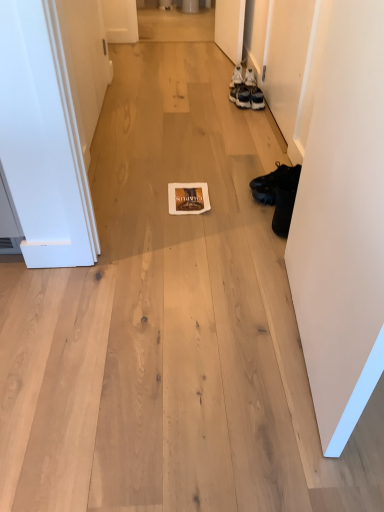
Measure the distance between point (259, 187) and camera.

The depth of point (259, 187) is 2.15 meters.

Describe the element at coordinates (240, 96) in the screenshot. This screenshot has width=384, height=512. I see `matte black sneakers at upper right, which is the third footwear from front to back` at that location.

Measure the distance between point (243,95) and camera.

A distance of 3.04 meters exists between point (243,95) and camera.

Locate an element on the screen. This screenshot has height=512, width=384. matte brown magazine at center is located at coordinates (188, 198).

Which of these two, matte black sneakers at upper right, which is the third footwear from front to back, or black leather boot at right, placed as the 2th footwear when sorted from bottom to top, is smaller?

Smaller between the two is matte black sneakers at upper right, which is the third footwear from front to back.

From the image's perspective, which one is positioned higher, matte black sneakers at upper right, which is the 3th footwear from bottom to top, or black leather boot at right, placed as the 2th footwear when sorted from bottom to top?

matte black sneakers at upper right, which is the 3th footwear from bottom to top, from the image's perspective.

Considering the relative positions of matte black sneakers at upper right, marked as the 2th footwear in a back-to-front arrangement, and black leather boot at right, which is the 2th footwear from front to back, in the image provided, is matte black sneakers at upper right, marked as the 2th footwear in a back-to-front arrangement, to the right of black leather boot at right, which is the 2th footwear from front to back, from the viewer's perspective?

Answer: In fact, matte black sneakers at upper right, marked as the 2th footwear in a back-to-front arrangement, is to the left of black leather boot at right, which is the 2th footwear from front to back.

Looking at this image, would you say white leather sneakers at upper right, the 4th footwear ordered from the bottom, is outside matte black sneakers at upper right, which is the 3th footwear from bottom to top?

Yes, white leather sneakers at upper right, the 4th footwear ordered from the bottom, is outside of matte black sneakers at upper right, which is the 3th footwear from bottom to top.

In the image, is white leather sneakers at upper right, the fourth footwear from the front, on the left side or the right side of matte black sneakers at upper right, marked as the 2th footwear in a back-to-front arrangement?

Clearly, white leather sneakers at upper right, the fourth footwear from the front, is on the right of matte black sneakers at upper right, marked as the 2th footwear in a back-to-front arrangement, in the image.

Which object is thinner, white leather sneakers at upper right, which ranks as the 1th footwear in back-to-front order, or matte black sneakers at upper right, which is the third footwear from front to back?

white leather sneakers at upper right, which ranks as the 1th footwear in back-to-front order, is thinner.

Does white leather sneakers at upper right, acting as the 1th footwear starting from the top, have a larger size compared to matte black sneakers at upper right, which is the 3th footwear from bottom to top?

Actually, white leather sneakers at upper right, acting as the 1th footwear starting from the top, might be smaller than matte black sneakers at upper right, which is the 3th footwear from bottom to top.

Does point (232, 80) come behind point (83, 115)?

Yes, point (232, 80) is farther from viewer.

Looking at the image, does white leather sneakers at upper right, the fourth footwear from the front, seem bigger or smaller compared to white painted wood door at left, which is the 2th door from front to back?

In the image, white leather sneakers at upper right, the fourth footwear from the front, appears to be smaller than white painted wood door at left, which is the 2th door from front to back.

The width and height of the screenshot is (384, 512). What are the coordinates of `the 3rd footwear behind when counting from the white painted wood door at left, the 1th door positioned from the left` in the screenshot? It's located at (237, 76).

Does white leather sneakers at upper right, the fourth footwear from the front, come in front of white painted wood door at left, which appears as the second door when ordered from the bottom?

No.

Is white painted wood door at left, the 1th door positioned from the left, completely or partially outside of white matte door at right, acting as the first door starting from the front?

white painted wood door at left, the 1th door positioned from the left, lies outside white matte door at right, acting as the first door starting from the front,'s area.

Considering the sizes of objects white painted wood door at left, marked as the first door in a back-to-front arrangement, and white matte door at right, placed as the 1th door when sorted from right to left, in the image provided, who is taller, white painted wood door at left, marked as the first door in a back-to-front arrangement, or white matte door at right, placed as the 1th door when sorted from right to left,?

white matte door at right, placed as the 1th door when sorted from right to left.

Based on the photo, is white painted wood door at left, which is the 2th door from front to back, bigger or smaller than white matte door at right, arranged as the second door when viewed from the top?

Considering their sizes, white painted wood door at left, which is the 2th door from front to back, takes up less space than white matte door at right, arranged as the second door when viewed from the top.

Would you consider black leather boot at right, the fourth footwear when ordered from top to bottom, to be distant from matte brown magazine at center?

Actually, black leather boot at right, the fourth footwear when ordered from top to bottom, and matte brown magazine at center are a little close together.

Can you confirm if black leather boot at right, marked as the first footwear in a bottom-to-top arrangement, is bigger than matte brown magazine at center?

Indeed, black leather boot at right, marked as the first footwear in a bottom-to-top arrangement, has a larger size compared to matte brown magazine at center.

Could you tell me if black leather boot at right, the fourth footwear when ordered from top to bottom, is turned towards matte brown magazine at center?

Yes, black leather boot at right, the fourth footwear when ordered from top to bottom, is oriented towards matte brown magazine at center.

From a real-world perspective, is black leather boot at right, marked as the first footwear in a bottom-to-top arrangement, located beneath matte brown magazine at center?

No.

Is black leather boot at right, marked as the first footwear in a bottom-to-top arrangement, located within black leather boot at right, placed as the 2th footwear when sorted from bottom to top?

No, black leather boot at right, marked as the first footwear in a bottom-to-top arrangement, is located outside of black leather boot at right, placed as the 2th footwear when sorted from bottom to top.

Is black leather boot at right, which is counted as the 3th footwear, starting from the top, further to the viewer compared to black leather boot at right, the fourth footwear when ordered from top to bottom?

Yes, it is behind black leather boot at right, the fourth footwear when ordered from top to bottom.

Is black leather boot at right, which is counted as the 3th footwear, starting from the top, oriented towards black leather boot at right, the fourth footwear when ordered from top to bottom?

No, black leather boot at right, which is counted as the 3th footwear, starting from the top, is not oriented towards black leather boot at right, the fourth footwear when ordered from top to bottom.

Does point (288, 178) come farther from viewer compared to point (289, 189)?

Yes, point (288, 178) is farther from viewer.

Is matte black sneakers at upper right, which is the 3th footwear from bottom to top, facing towards black leather boot at right, which is the fourth footwear from back to front?

No, matte black sneakers at upper right, which is the 3th footwear from bottom to top, is not turned towards black leather boot at right, which is the fourth footwear from back to front.

Is matte black sneakers at upper right, which is the third footwear from front to back, bigger than black leather boot at right, which is the fourth footwear from back to front?

Actually, matte black sneakers at upper right, which is the third footwear from front to back, might be smaller than black leather boot at right, which is the fourth footwear from back to front.

Is the depth of matte black sneakers at upper right, which is the 2th footwear from top to bottom, less than that of black leather boot at right, marked as the first footwear in a bottom-to-top arrangement?

No, matte black sneakers at upper right, which is the 2th footwear from top to bottom, is behind black leather boot at right, marked as the first footwear in a bottom-to-top arrangement.

From a real-world perspective, relative to black leather boot at right, marked as the first footwear in a bottom-to-top arrangement, is matte black sneakers at upper right, marked as the 2th footwear in a back-to-front arrangement, vertically above or below?

From a real-world perspective, matte black sneakers at upper right, marked as the 2th footwear in a back-to-front arrangement, is physically below black leather boot at right, marked as the first footwear in a bottom-to-top arrangement.

Where is `footwear below the matte black sneakers at upper right, which is the 3th footwear from bottom to top (from a real-world perspective)`? The width and height of the screenshot is (384, 512). footwear below the matte black sneakers at upper right, which is the 3th footwear from bottom to top (from a real-world perspective) is located at coordinates (277, 177).

Locate an element on the screen. The height and width of the screenshot is (512, 384). footwear behind the matte black sneakers at upper right, which is the 2th footwear from top to bottom is located at coordinates (237, 76).

Based on their spatial positions, is matte black sneakers at upper right, which is the third footwear from front to back, or white painted wood door at left, which is the 2th door from front to back, closer to matte brown magazine at center?

white painted wood door at left, which is the 2th door from front to back, is closer to matte brown magazine at center.

Based on their spatial positions, is white matte door at right, which is the first door from bottom to top, or black leather boot at right, the fourth footwear when ordered from top to bottom, closer to white painted wood door at left, which appears as the second door when ordered from the bottom?

The object closer to white painted wood door at left, which appears as the second door when ordered from the bottom, is white matte door at right, which is the first door from bottom to top.

Based on their spatial positions, is matte brown magazine at center or white matte door at right, the 2th door when ordered from back to front, closer to white painted wood door at left, which is counted as the first door, starting from the top?

Among the two, matte brown magazine at center is located nearer to white painted wood door at left, which is counted as the first door, starting from the top.

Looking at the image, which one is located further to white matte door at right, which is the first door from bottom to top, black leather boot at right, which is counted as the 3th footwear, starting from the top, or white painted wood door at left, which appears as the second door when ordered from the bottom?

Among the two, white painted wood door at left, which appears as the second door when ordered from the bottom, is located further to white matte door at right, which is the first door from bottom to top.

Which object lies further to the anchor point black leather boot at right, which is counted as the 3th footwear, starting from the top, white painted wood door at left, which is counted as the first door, starting from the top, or black leather boot at right, marked as the first footwear in a bottom-to-top arrangement?

white painted wood door at left, which is counted as the first door, starting from the top, is positioned further to the anchor black leather boot at right, which is counted as the 3th footwear, starting from the top.

When comparing their distances from matte brown magazine at center, does black leather boot at right, which is the 2th footwear from front to back, or matte black sneakers at upper right, which is the third footwear from front to back, seem further?

matte black sneakers at upper right, which is the third footwear from front to back, is positioned further to the anchor matte brown magazine at center.

Based on their spatial positions, is matte black sneakers at upper right, which is the 3th footwear from bottom to top, or white painted wood door at left, which is counted as the first door, starting from the top, further from white matte door at right, acting as the first door starting from the front?

matte black sneakers at upper right, which is the 3th footwear from bottom to top.

Considering their positions, is matte brown magazine at center positioned closer to matte black sneakers at upper right, marked as the 2th footwear in a back-to-front arrangement, than black leather boot at right, which is the 2th footwear from front to back?

The object closer to matte black sneakers at upper right, marked as the 2th footwear in a back-to-front arrangement, is black leather boot at right, which is the 2th footwear from front to back.

You are a GUI agent. You are given a task and a screenshot of the screen. Output one action in this format:
    pyautogui.click(x=<x>, y=<y>)
    Task: Click on the door located between white matte door at right, which is the first door from bottom to top, and matte black sneakers at upper right, marked as the 2th footwear in a back-to-front arrangement, in the depth direction
    
    Given the screenshot: What is the action you would take?
    pyautogui.click(x=85, y=61)

Where is `magazine between black leather boot at right, which is the fourth footwear from back to front, and matte black sneakers at upper right, which is the third footwear from front to back, from front to back`? The height and width of the screenshot is (512, 384). magazine between black leather boot at right, which is the fourth footwear from back to front, and matte black sneakers at upper right, which is the third footwear from front to back, from front to back is located at coordinates (188, 198).

I want to click on footwear between matte brown magazine at center and matte black sneakers at upper right, which is the 3th footwear from bottom to top, from front to back, so click(277, 177).

Where is `magazine between white matte door at right, arranged as the second door when viewed from the top, and white leather sneakers at upper right, the fourth footwear from the front, along the z-axis`? magazine between white matte door at right, arranged as the second door when viewed from the top, and white leather sneakers at upper right, the fourth footwear from the front, along the z-axis is located at coordinates (188, 198).